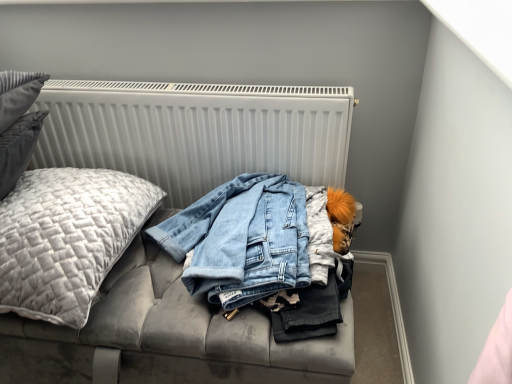
Question: Looking at their shapes, would you say quilted gray pillow at left is wider or thinner than white ribbed radiator at upper center?

Choices:
 (A) wide
 (B) thin

Answer: (A)

Question: Is point (96, 187) positioned closer to the camera than point (334, 97)?

Choices:
 (A) farther
 (B) closer

Answer: (B)

Question: Which object is the farthest from the quilted gray pillow at left?

Choices:
 (A) white ribbed radiator at upper center
 (B) velvet grey couch at center

Answer: (B)

Question: Which is nearer to the velvet grey couch at center?

Choices:
 (A) quilted gray pillow at left
 (B) white ribbed radiator at upper center

Answer: (B)